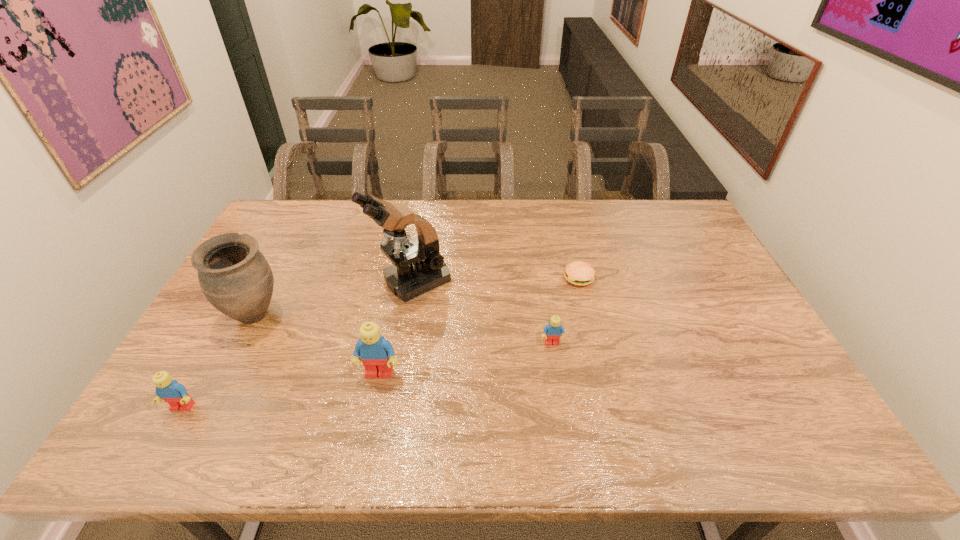
Point out which Lego is positioned as the second nearest to the fourth farthest object. Please provide its 2D coordinates. Your answer should be formatted as a tuple, i.e. [(x, y)], where the tuple contains the x and y coordinates of a point satisfying the conditions above.

[(171, 391)]

Point out which Lego is positioned as the nearest to the tallest Lego. Please provide its 2D coordinates. Your answer should be formatted as a tuple, i.e. [(x, y)], where the tuple contains the x and y coordinates of a point satisfying the conditions above.

[(171, 391)]

Where is `free location that satisfies the following two spatial constraints: 1. on the back side of the urn; 2. on the right side of the patty`? The width and height of the screenshot is (960, 540). free location that satisfies the following two spatial constraints: 1. on the back side of the urn; 2. on the right side of the patty is located at coordinates (275, 278).